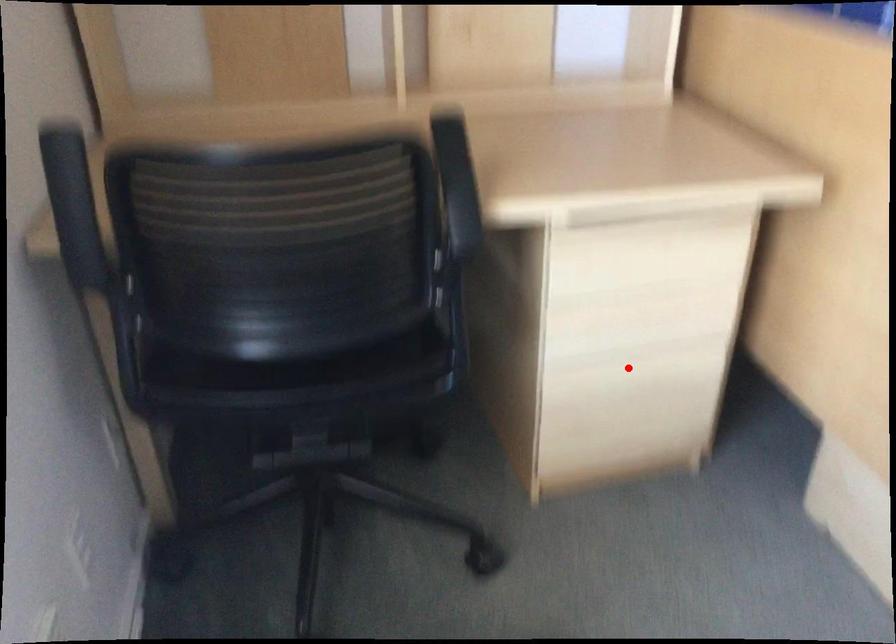
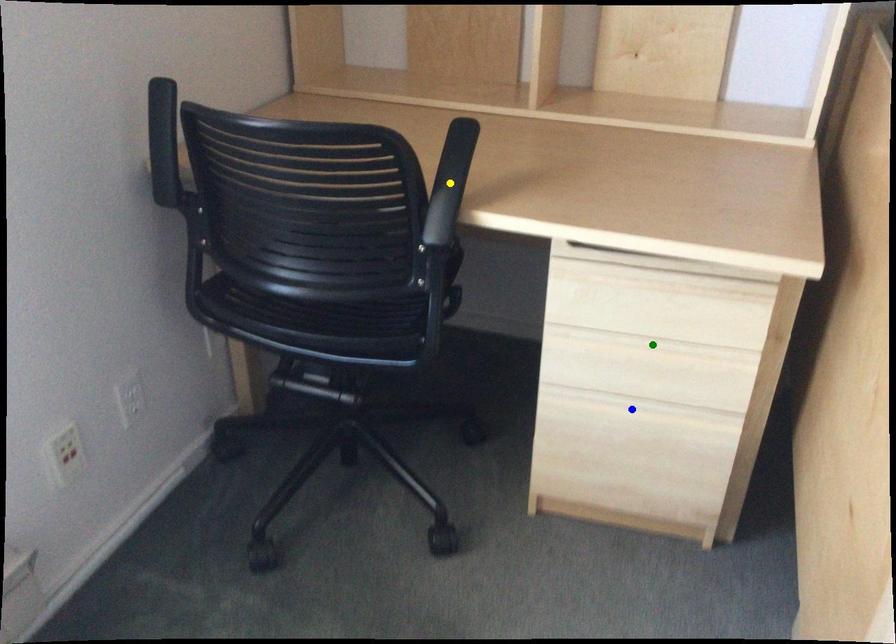
Question: I am providing you with two images of the same scene from different viewpoints. A red point is marked on the first image. You are given multiple points on the second image. Which spot in image 2 lines up with the point in image 1?

Choices:
 (A) green point
 (B) blue point
 (C) yellow point

Answer: (B)